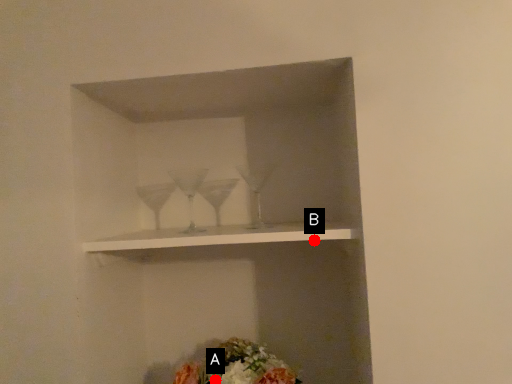
Question: Two points are circled on the image, labeled by A and B beside each circle. Among these points, which one is farthest from the camera?

Choices:
 (A) A is further
 (B) B is further

Answer: (B)